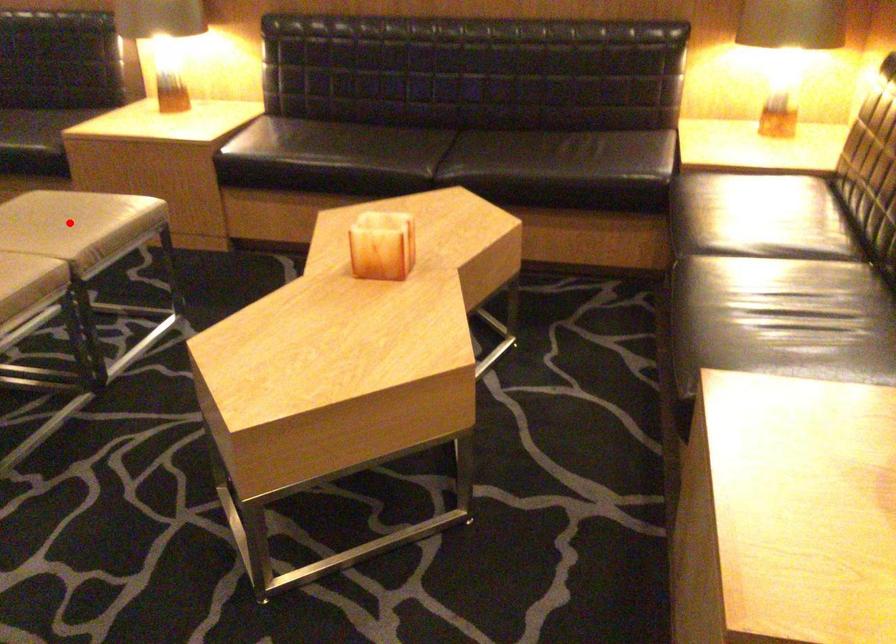
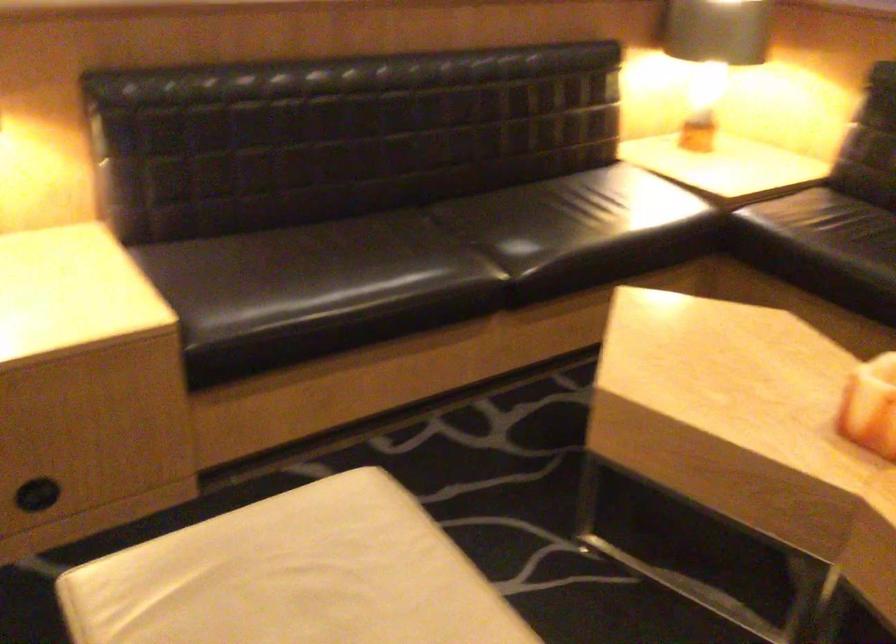
Question: I am providing you with two images of the same scene from different viewpoints. A red point is marked on the first image. At the location where the point appears in image 1, is it still visible in image 2?

Choices:
 (A) Yes
 (B) No

Answer: (B)